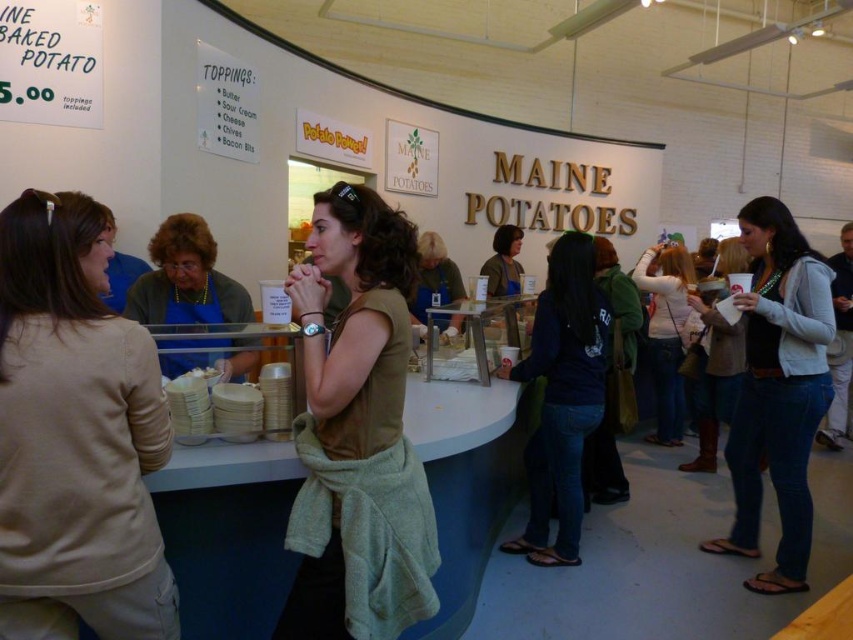
Question: Does denim jeans at right appear over white matte shirt at center?

Choices:
 (A) yes
 (B) no

Answer: (B)

Question: Which object appears closest to the camera in this image?

Choices:
 (A) matte green sweater at center
 (B) green matte shirt at center
 (C) dark blue jeans at center

Answer: (B)

Question: Can you confirm if beige fabric shirt at left is positioned to the right of green cotton hoodie at center?

Choices:
 (A) no
 (B) yes

Answer: (A)

Question: Among these objects, which one is nearest to the camera?

Choices:
 (A) green matte shirt at center
 (B) denim jeans at right
 (C) green cotton hoodie at center
 (D) dark blue jeans at center

Answer: (A)

Question: Which object is farther from the camera taking this photo?

Choices:
 (A) matte white cup at center right
 (B) matte green sweater at center

Answer: (B)

Question: Can you confirm if denim jeans at right is smaller than matte green sweater at center?

Choices:
 (A) yes
 (B) no

Answer: (B)